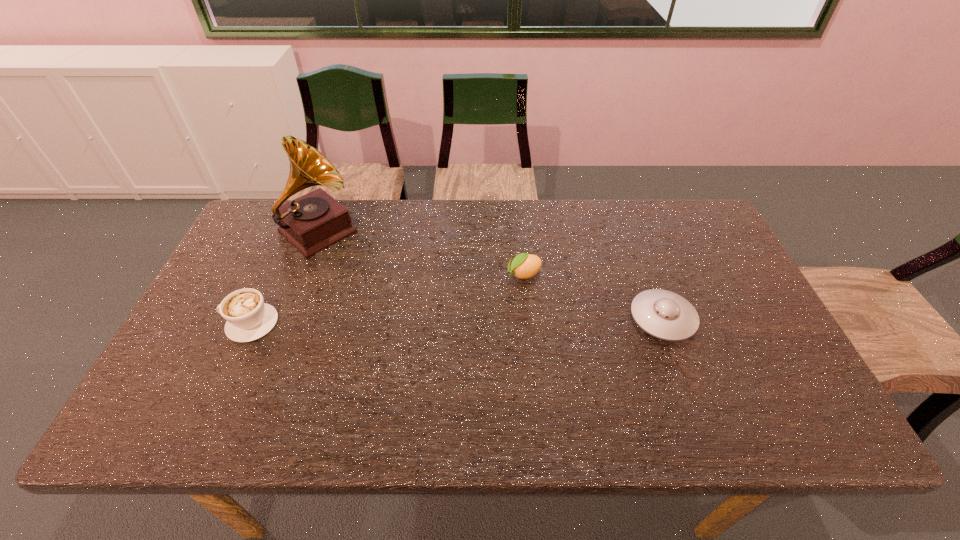
I want to click on cappuccino, so click(x=248, y=318).

At what (x,y) coordinates should I click in order to perform the action: click on saucer. Please return your answer as a coordinate pair (x, y). This screenshot has height=540, width=960. Looking at the image, I should click on (663, 314).

Identify the location of the shortest object. tap(663, 314).

You are a GUI agent. You are given a task and a screenshot of the screen. Output one action in this format:
    pyautogui.click(x=<x>, y=<y>)
    Task: Click on the tallest object
    
    Given the screenshot: What is the action you would take?
    pyautogui.click(x=314, y=221)

This screenshot has height=540, width=960. In order to click on phonograph record in this screenshot , I will do tap(314, 221).

The height and width of the screenshot is (540, 960). Find the location of `the second farthest object`. the second farthest object is located at coordinates (524, 266).

This screenshot has height=540, width=960. I want to click on lemon, so click(x=524, y=266).

Locate an element on the screen. Image resolution: width=960 pixels, height=540 pixels. free region located 0.060m on the left of the saucer is located at coordinates (608, 319).

Locate an element on the screen. Image resolution: width=960 pixels, height=540 pixels. free region located from the horn of the tallest object is located at coordinates (380, 285).

Identify the location of blank area located from the horn of the tallest object. (358, 266).